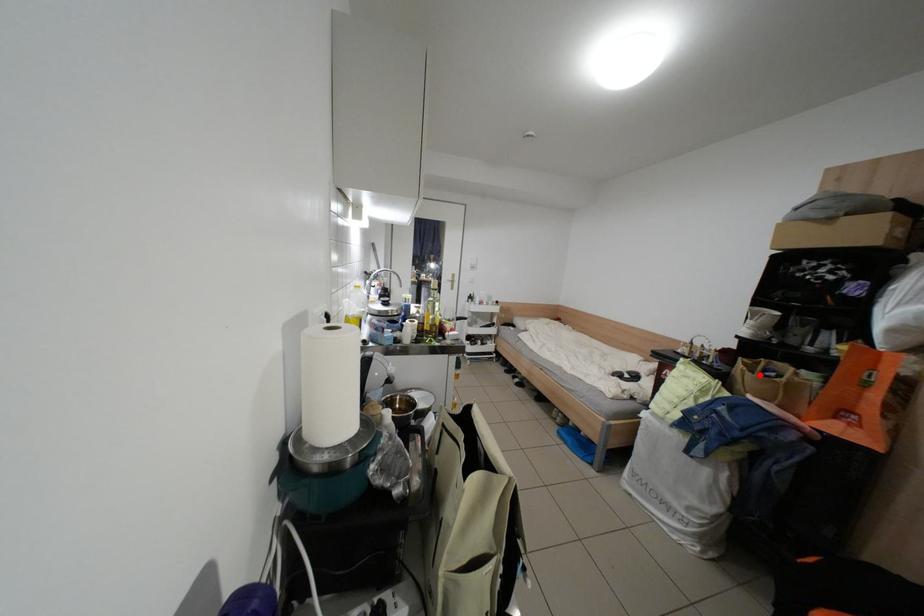
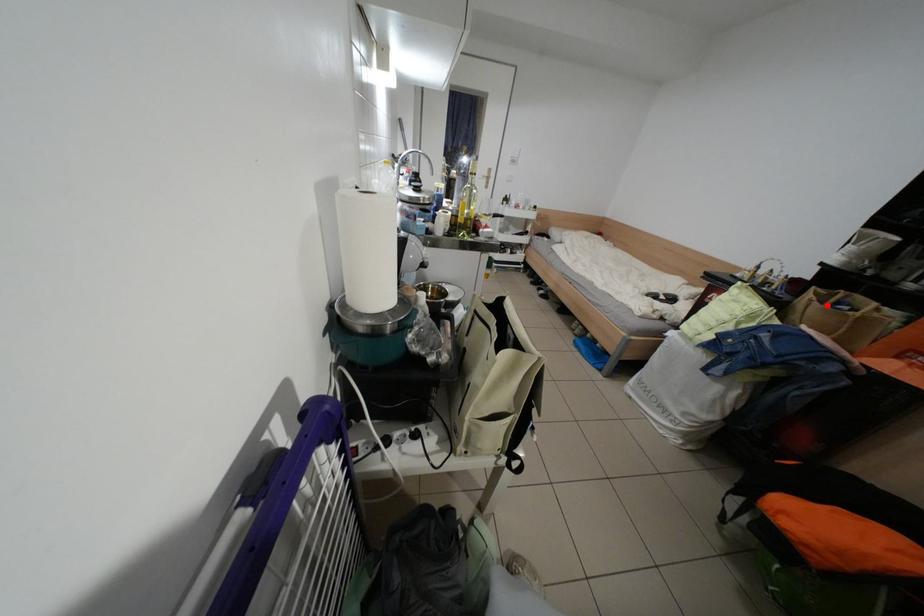
I am providing you with two images of the same scene from different viewpoints. A red point is marked on the first image and another point is marked on the second image. Is the red point in image1 aligned with the point shown in image2?

Yes